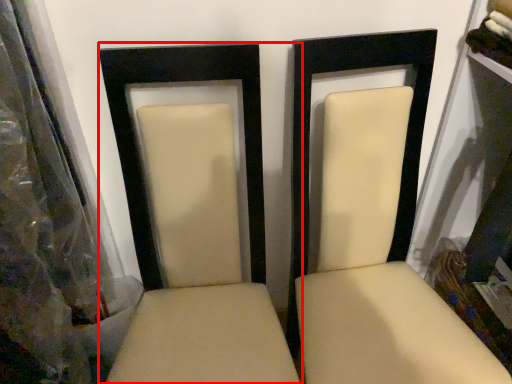
Question: From the image's perspective, where is chair (annotated by the red box) located in relation to chair in the image?

Choices:
 (A) below
 (B) above

Answer: (A)